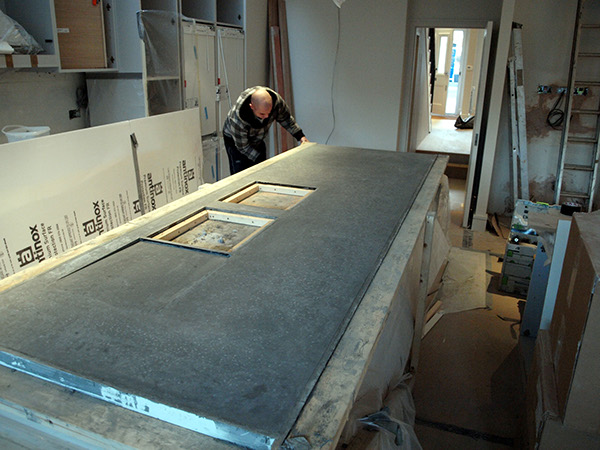
The image size is (600, 450). Find the location of `cabinets`. cabinets is located at coordinates (241, 57), (205, 53), (209, 149), (221, 158).